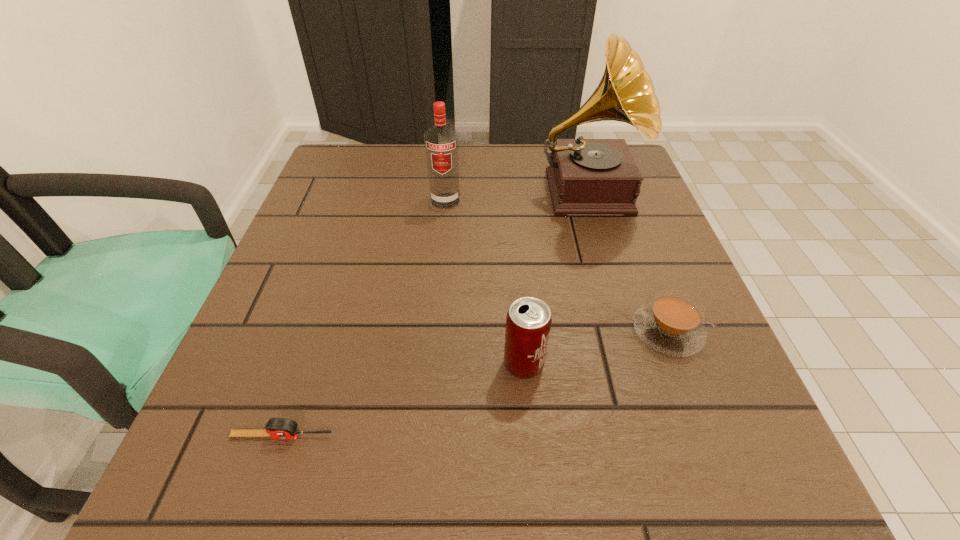
Locate an element on the screen. Image resolution: width=960 pixels, height=540 pixels. unoccupied position between the fourth tallest object and the tallest object is located at coordinates pos(627,261).

Identify the location of empty location between the phonograph record and the third tallest object. This screenshot has width=960, height=540. (555, 278).

Find the location of a particular element. object that ranks as the closest to the phonograph record is located at coordinates (441, 142).

Identify the location of the second closest object to the tallest object. (672, 324).

The width and height of the screenshot is (960, 540). What are the coordinates of `vacant space that satisfies the following two spatial constraints: 1. on the back side of the third tallest object; 2. on the right side of the tape measure` in the screenshot? It's located at (305, 364).

The width and height of the screenshot is (960, 540). I want to click on vacant space that satisfies the following two spatial constraints: 1. on the front label of the second object from left to right; 2. on the right side of the cappuccino, so click(x=433, y=331).

Image resolution: width=960 pixels, height=540 pixels. Identify the location of free location that satisfies the following two spatial constraints: 1. from the horn of the tallest object; 2. on the left side of the fourth tallest object. (628, 331).